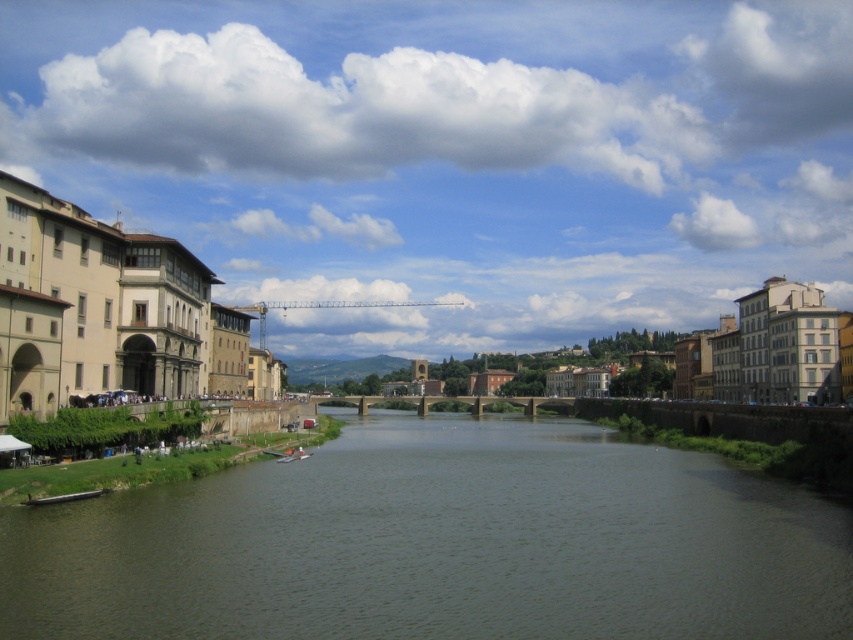
You are a photographer planning to capture the brown concrete river at center and the wooden boat at lower left in a single frame. Which object should you focus on first if you want to ensure both are in focus, considering their relative sizes in the frame?

The brown concrete river at center is much taller than the wooden boat at lower left, so focusing on the brown concrete river at center would ensure both are in focus since it occupies a larger portion of the frame.

What is the coordinate of the brown concrete river at center?

The coordinate of the brown concrete river at center is at point (439,544).